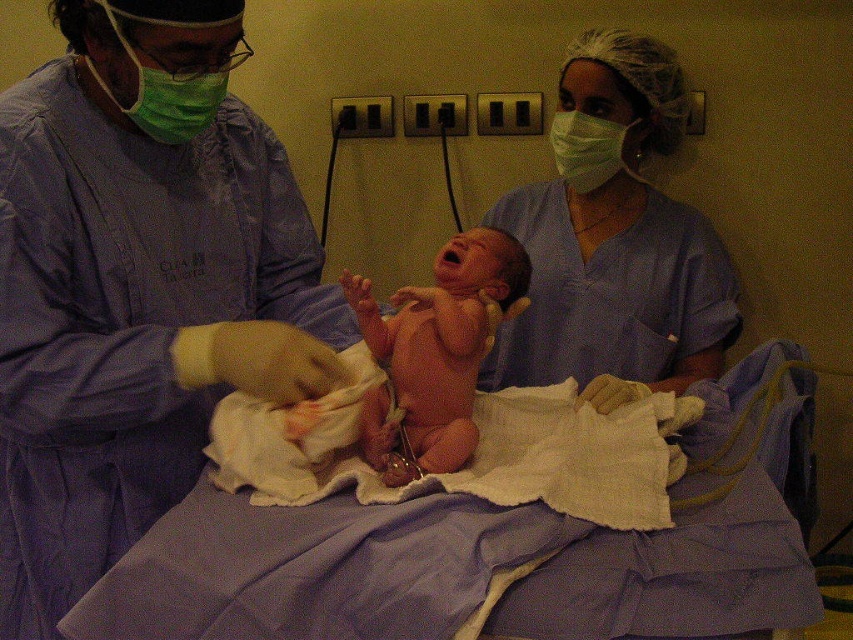
You are a nurse entering the room and need to choose a mask that fits over your mouth and nose properly. Which mask between the green fabric mask at upper left and the green matte mask at upper center would you select based on size?

The green fabric mask at upper left has a larger size compared to the green matte mask at upper center, so you should choose the green fabric mask at upper left for proper fit over your mouth and nose.

Looking at this image, you are a new nurse in the hospital and need to locate the medical equipment cart. The nearest object to the matte blue scrubs at center is the cart. Where would you find the cart?

The cart is located at the position closest to the matte blue scrubs at center, which is at point (614,241).

You are a medical student observing a newborn care procedure. You need to locate the exact position of the matte blue scrubs at center in the image. What are the coordinates where they are located?

The matte blue scrubs at center are located at coordinates point (614, 241).